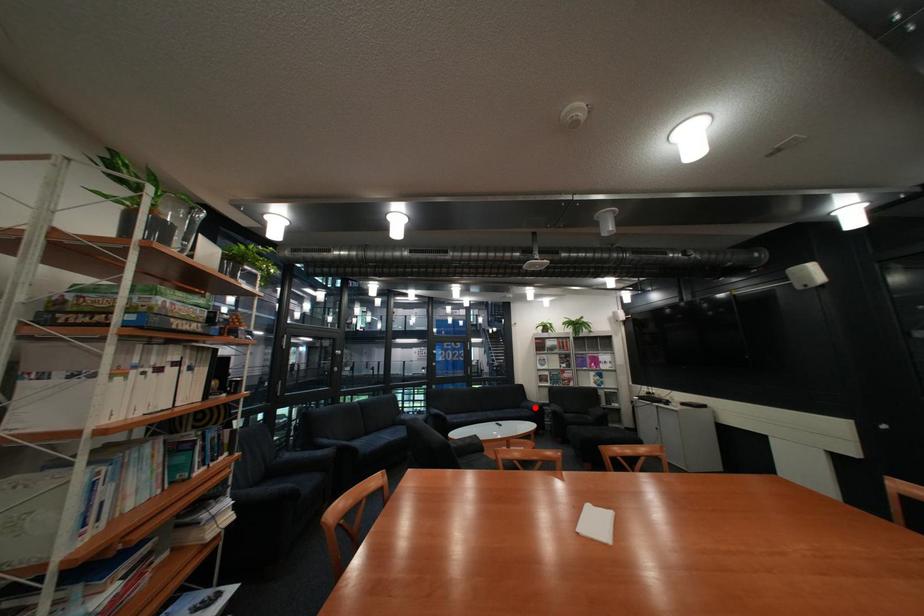
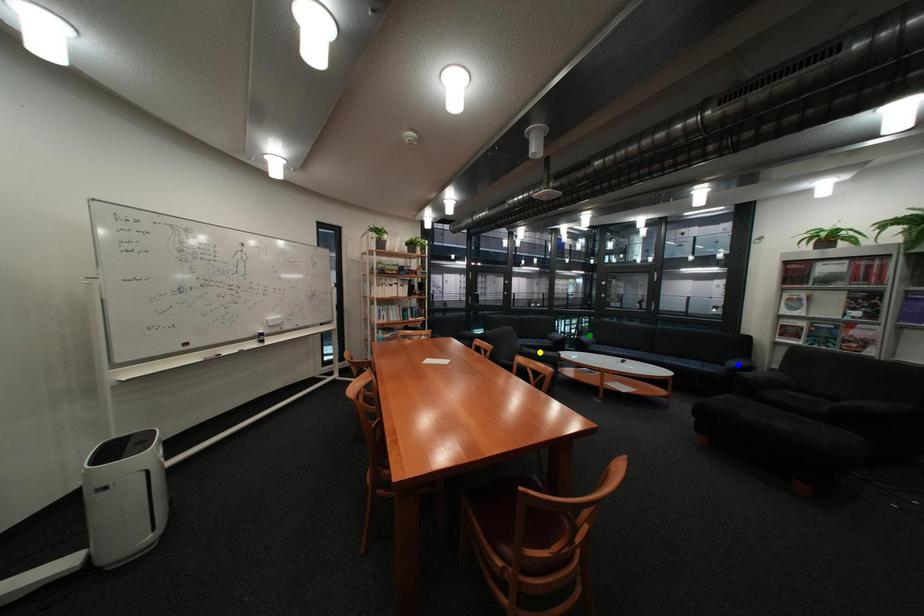
Question: I am providing you with two images of the same scene from different viewpoints. A red point is marked on the first image. You are given multiple points on the second image. Which mark in image 2 goes with the point in image 1?

Choices:
 (A) green point
 (B) blue point
 (C) yellow point

Answer: (B)